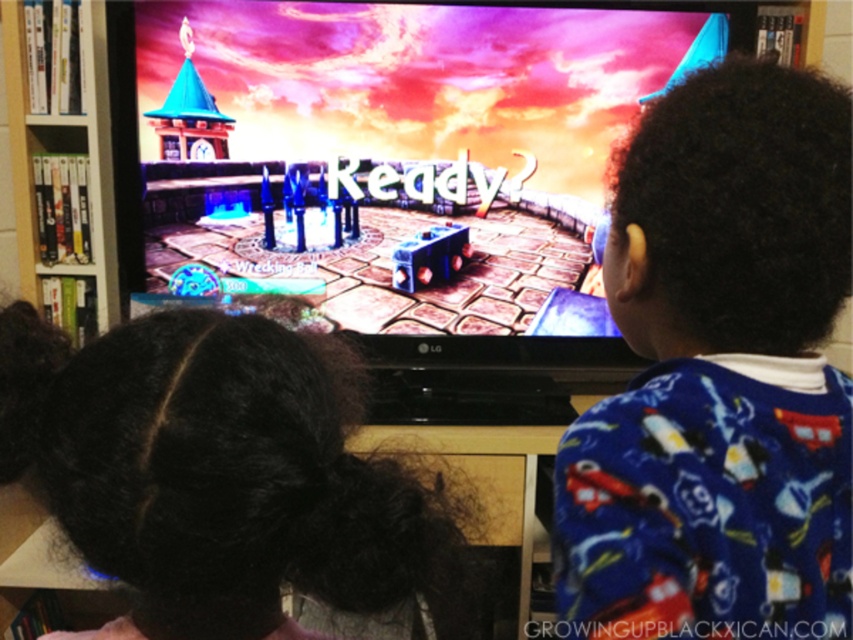
You are a photographer trying to capture a photo of the white glossy bookshelf at left without including the black curly hair at lower left in the frame. Based on their positions, is this possible?

The black curly hair at lower left is below the white glossy bookshelf at left, so if you position the camera to focus on the upper part of the white glossy bookshelf at left, you can exclude the black curly hair at lower left from the frame.

You are a photographer trying to capture a photo of the blue fleece pajamas at right and the white glossy bookshelf at left. Since you want both objects in the frame, which object should you position closer to the camera to ensure both are visible?

You should position the white glossy bookshelf at left closer to the camera because the blue fleece pajamas at right is on the right side of it, so moving the bookshelf forward would keep both in view.

You are a photographer taking a picture of the scene. You want to focus on the black curly hair at lower left and the white glossy bookshelf at left. Which object should you adjust your camera focus on first to ensure both are in focus?

You should focus on the black curly hair at lower left first because it is closer to the viewer than the white glossy bookshelf at left. By focusing on the closer object, the depth of field may also keep the farther object in focus.